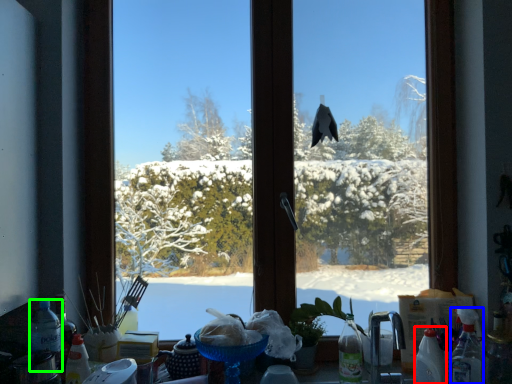
Question: Which is farther away from bottle (highlighted by a red box)? bottle (highlighted by a blue box) or bottle (highlighted by a green box)?

Choices:
 (A) bottle
 (B) bottle

Answer: (B)